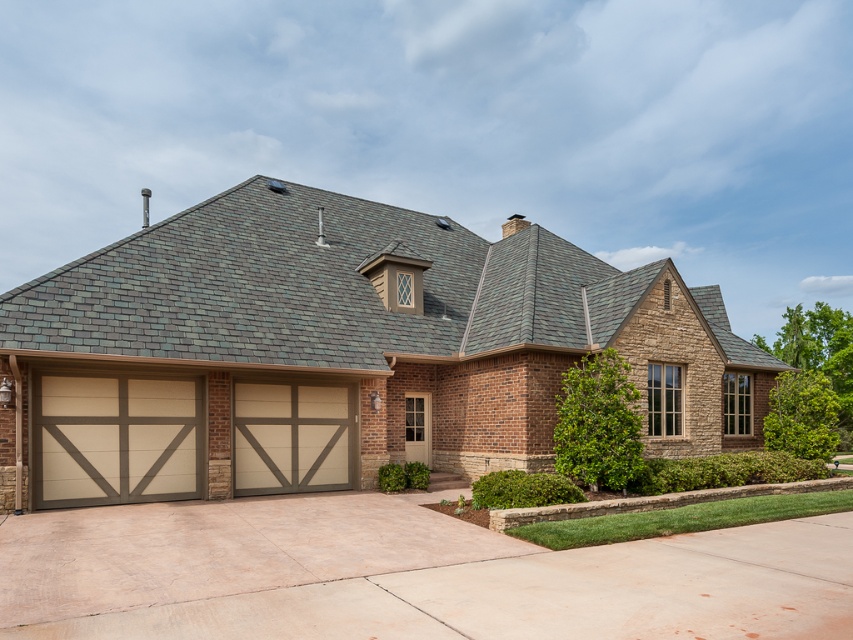
Is point (392, 598) farther from viewer compared to point (262, 435)?

No, (392, 598) is in front of (262, 435).

In order to click on concrete at center in this screenshot , I will do `click(405, 576)`.

Between point (640, 586) and point (331, 392), which one is positioned in front?

Positioned in front is point (640, 586).

I want to click on concrete at center, so click(405, 576).

Is point (474, 394) positioned after point (287, 428)?

Yes, point (474, 394) is behind point (287, 428).

The height and width of the screenshot is (640, 853). What do you see at coordinates (341, 353) in the screenshot?
I see `beige wood garage doors at lower left` at bounding box center [341, 353].

Where is `beige wood garage doors at lower left`? This screenshot has width=853, height=640. beige wood garage doors at lower left is located at coordinates (341, 353).

Who is more distant from viewer, (531,433) or (138,422)?

The point (531,433) is more distant.

Does beige wood garage doors at lower left have a greater height compared to beige wood-paneled garage door at lower left?

Correct, beige wood garage doors at lower left is much taller as beige wood-paneled garage door at lower left.

Is point (260, 362) closer to camera compared to point (167, 472)?

No, (260, 362) is further to viewer.

The image size is (853, 640). I want to click on beige wood garage doors at lower left, so click(x=341, y=353).